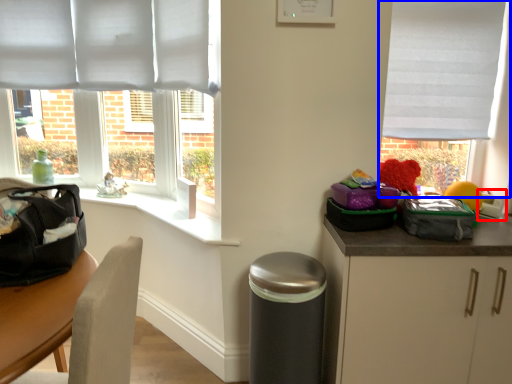
Question: Which object appears closest to the camera in this image, appliance (highlighted by a red box) or window (highlighted by a blue box)?

Choices:
 (A) appliance
 (B) window

Answer: (A)